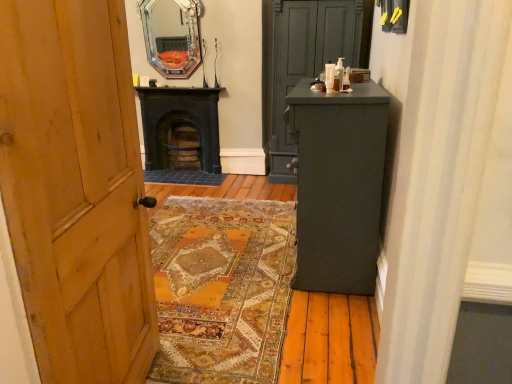
Question: Is matte gray cabinet at center completely or partially outside of matte dark gray cabinet at right?

Choices:
 (A) yes
 (B) no

Answer: (A)

Question: Is matte gray cabinet at center taller than matte dark gray cabinet at right?

Choices:
 (A) yes
 (B) no

Answer: (A)

Question: Is matte gray cabinet at center turned away from matte dark gray cabinet at right?

Choices:
 (A) no
 (B) yes

Answer: (A)

Question: From a real-world perspective, is matte gray cabinet at center physically above matte dark gray cabinet at right?

Choices:
 (A) yes
 (B) no

Answer: (A)

Question: From the image's perspective, does matte gray cabinet at center appear higher than matte dark gray cabinet at right?

Choices:
 (A) no
 (B) yes

Answer: (B)

Question: Is matte gray cabinet at center wider than matte dark gray cabinet at right?

Choices:
 (A) no
 (B) yes

Answer: (B)

Question: Could you tell me if silver-framed mirror at upper center is turned towards matte gray cabinet at center?

Choices:
 (A) yes
 (B) no

Answer: (B)

Question: Can you confirm if silver-framed mirror at upper center is bigger than matte gray cabinet at center?

Choices:
 (A) no
 (B) yes

Answer: (A)

Question: From the image's perspective, is silver-framed mirror at upper center over matte gray cabinet at center?

Choices:
 (A) no
 (B) yes

Answer: (B)

Question: Is silver-framed mirror at upper center wider than matte gray cabinet at center?

Choices:
 (A) yes
 (B) no

Answer: (B)

Question: Considering the relative sizes of silver-framed mirror at upper center and matte gray cabinet at center in the image provided, is silver-framed mirror at upper center shorter than matte gray cabinet at center?

Choices:
 (A) no
 (B) yes

Answer: (B)

Question: Can we say silver-framed mirror at upper center lies outside matte gray cabinet at center?

Choices:
 (A) no
 (B) yes

Answer: (B)

Question: From the image's perspective, is black cast iron stove at center under silver-framed mirror at upper center?

Choices:
 (A) no
 (B) yes

Answer: (B)